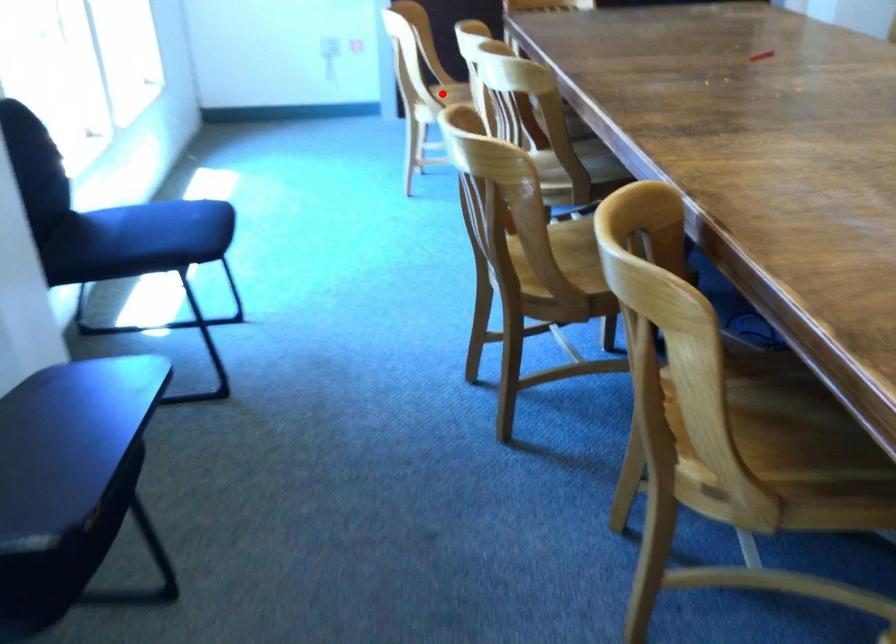
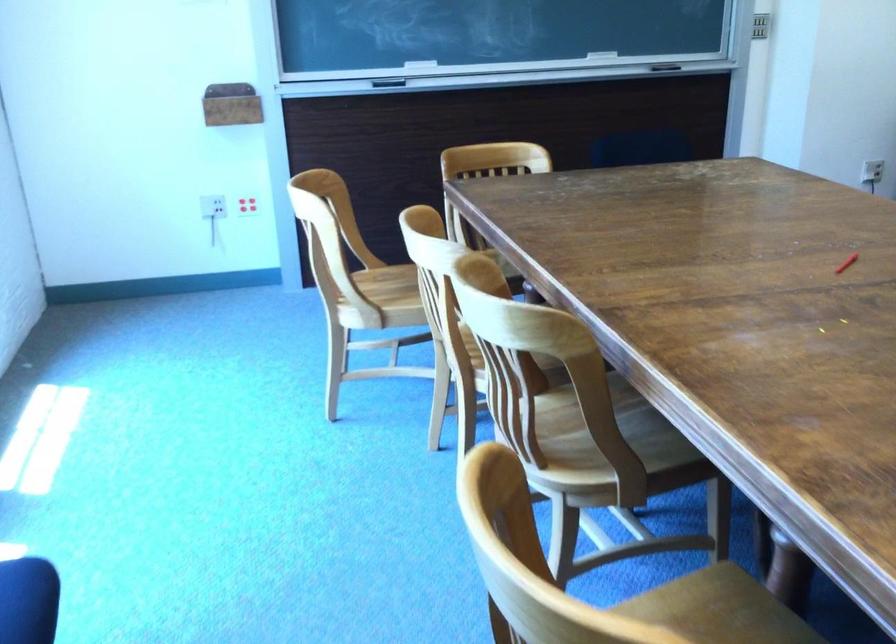
Question: I am providing you with two images of the same scene from different viewpoints. Image1 has a red point marked. In image2, the corresponding 3D location appears at what relative position? Reply with the corresponding letter.

Choices:
 (A) Closer
 (B) Farther

Answer: (A)